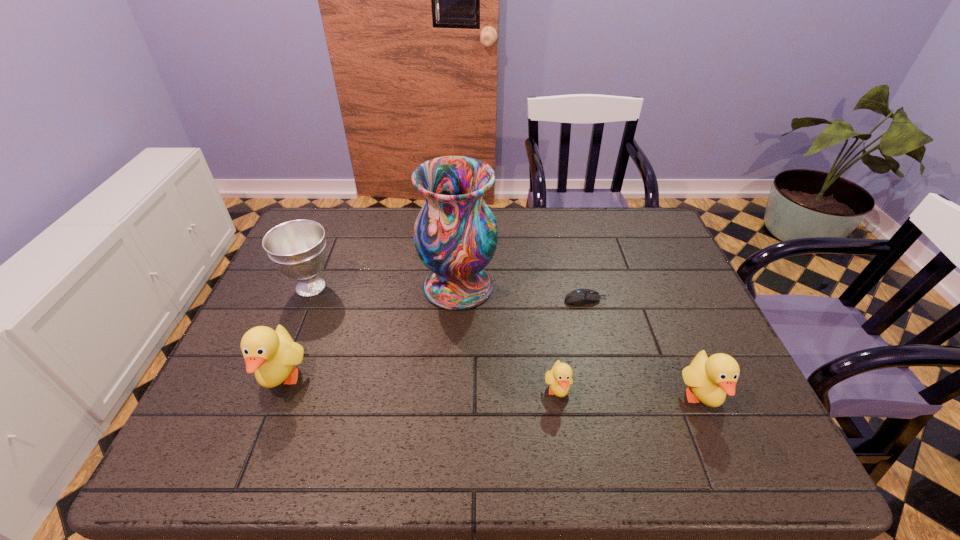
This screenshot has height=540, width=960. I want to click on vacant point located on the back of the tallest object, so click(x=461, y=232).

The width and height of the screenshot is (960, 540). What are the coordinates of `blank area located on the left of the fifth object from left to right` in the screenshot? It's located at (456, 300).

This screenshot has width=960, height=540. Identify the location of vacant space located on the right of the chalice. (403, 287).

Identify the location of duckling at the left edge. This screenshot has width=960, height=540. (272, 355).

Locate an element on the screen. chalice located at the left edge is located at coordinates (297, 248).

This screenshot has height=540, width=960. Find the location of `object that is at the right edge`. object that is at the right edge is located at coordinates (709, 379).

The image size is (960, 540). Find the location of `object at the near left corner`. object at the near left corner is located at coordinates (272, 355).

Identify the location of object that is positioned at the near right corner. This screenshot has width=960, height=540. (709, 379).

You are a GUI agent. You are given a task and a screenshot of the screen. Output one action in this format:
    pyautogui.click(x=<x>, y=<y>)
    Task: Click on the vacant space at the far edge
    The width and height of the screenshot is (960, 540).
    Given the screenshot: What is the action you would take?
    pyautogui.click(x=361, y=213)

Locate an element on the screen. This screenshot has width=960, height=540. free space at the near edge of the desktop is located at coordinates (299, 388).